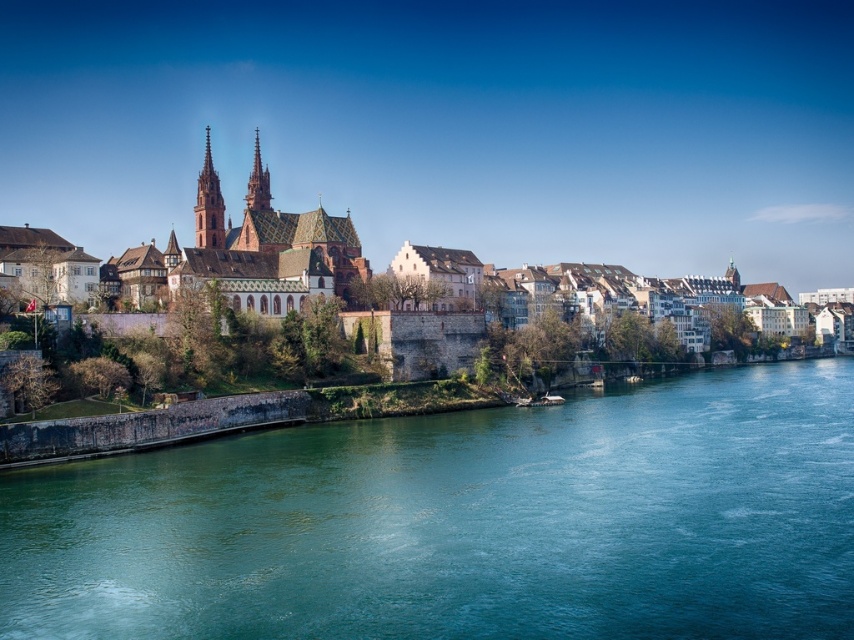
Between greenish-blue water at lower left and smooth stone spire at center, which one has more height?

With more height is smooth stone spire at center.

Does greenish-blue water at lower left have a lesser height compared to smooth stone spire at center?

Yes, greenish-blue water at lower left is shorter than smooth stone spire at center.

Does point (735, 472) come farther from viewer compared to point (215, 234)?

No, it is in front of (215, 234).

At what (x,y) coordinates should I click in order to perform the action: click on greenish-blue water at lower left. Please return your answer as a coordinate pair (x, y). Looking at the image, I should click on (463, 522).

Who is more forward, (133, 289) or (196, 220)?

Positioned in front is point (133, 289).

Find the location of `brown stone town at center`. brown stone town at center is located at coordinates (256, 257).

The width and height of the screenshot is (854, 640). In order to click on brown stone town at center in this screenshot , I will do `click(256, 257)`.

You are a GUI agent. You are given a task and a screenshot of the screen. Output one action in this format:
    pyautogui.click(x=<x>, y=<y>)
    Task: Click on the brown stone town at center
    The width and height of the screenshot is (854, 640).
    Given the screenshot: What is the action you would take?
    click(x=256, y=257)

Does greenish-blue water at lower left appear on the left side of reddish-brown stone spire at center?

Incorrect, greenish-blue water at lower left is not on the left side of reddish-brown stone spire at center.

Is greenish-blue water at lower left above reddish-brown stone spire at center?

Actually, greenish-blue water at lower left is below reddish-brown stone spire at center.

Is point (104, 480) behind point (258, 179)?

No, it is not.

At what (x,y) coordinates should I click in order to perform the action: click on greenish-blue water at lower left. Please return your answer as a coordinate pair (x, y). The width and height of the screenshot is (854, 640). Looking at the image, I should click on (463, 522).